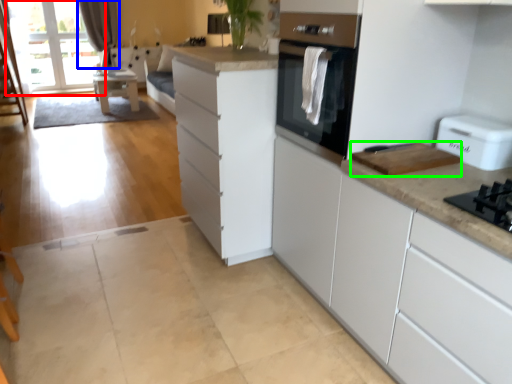
Question: Estimate the real-world distances between objects in this image. Which object is closer to window screen (highlighted by a red box), curtain (highlighted by a blue box) or appliance (highlighted by a green box)?

Choices:
 (A) curtain
 (B) appliance

Answer: (A)